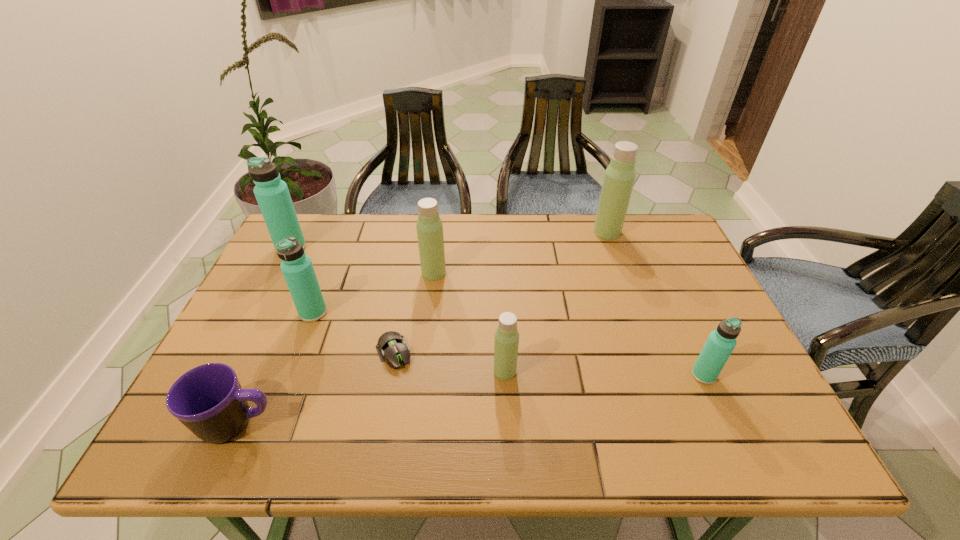
Find the location of `vacant position located 0.350m on the back of the second light thermos bottle from left to right`. vacant position located 0.350m on the back of the second light thermos bottle from left to right is located at coordinates (499, 266).

Locate an element on the screen. free spot located on the back of the rightmost aqua thermos bottle is located at coordinates [684, 330].

You are a GUI agent. You are given a task and a screenshot of the screen. Output one action in this format:
    pyautogui.click(x=<x>, y=<y>)
    Task: Click on the vacant space located 0.300m with the handle on the side of the nearest object
    
    Given the screenshot: What is the action you would take?
    pyautogui.click(x=421, y=424)

Identify the location of free point located on the back of the gray computer mouse. Image resolution: width=960 pixels, height=540 pixels. (402, 304).

Where is `object located in the near edge section of the desktop`? The image size is (960, 540). object located in the near edge section of the desktop is located at coordinates (208, 399).

Identify the location of mug present at the left edge. The width and height of the screenshot is (960, 540). (208, 399).

Where is `object located at the right edge`? object located at the right edge is located at coordinates (721, 342).

The height and width of the screenshot is (540, 960). In order to click on object that is positioned at the far left corner in this screenshot , I will do `click(272, 194)`.

Find the location of `object that is at the near left corner`. object that is at the near left corner is located at coordinates [208, 399].

Find the location of a particular element. free space at the far edge of the desktop is located at coordinates click(591, 223).